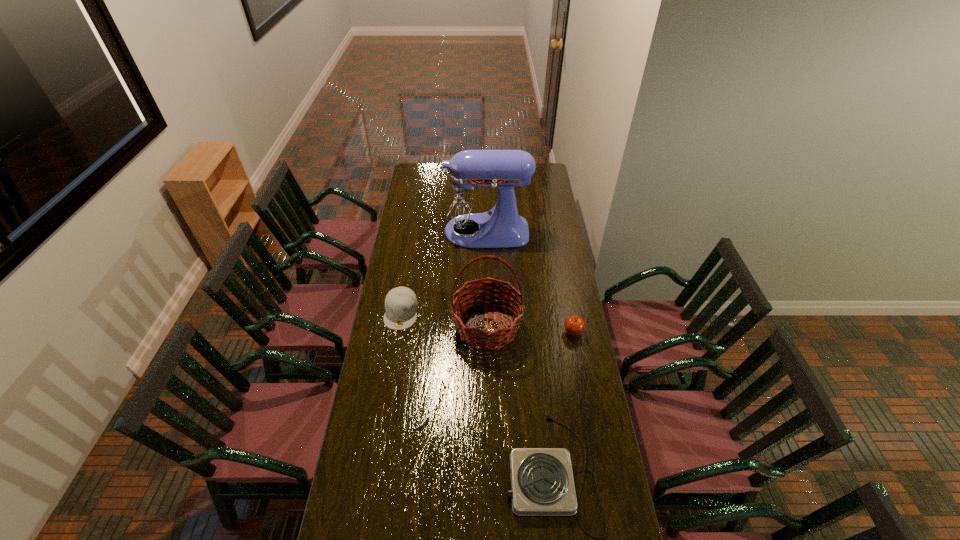
Where is `free space located 0.270m on the front-facing side of the leftmost object`? free space located 0.270m on the front-facing side of the leftmost object is located at coordinates (390, 383).

Where is `blank space located 0.350m on the front of the apple`? The image size is (960, 540). blank space located 0.350m on the front of the apple is located at coordinates (588, 415).

This screenshot has width=960, height=540. Find the location of `free location located with a retractable cable on the side of the nearest object`. free location located with a retractable cable on the side of the nearest object is located at coordinates click(404, 471).

Where is `vacant region located 0.140m with a retractable cable on the side of the nearest object`? vacant region located 0.140m with a retractable cable on the side of the nearest object is located at coordinates (465, 471).

Locate an element on the screen. Image resolution: width=960 pixels, height=540 pixels. vacant space situated with a retractable cable on the side of the nearest object is located at coordinates (473, 471).

This screenshot has height=540, width=960. Find the location of `object present at the left edge`. object present at the left edge is located at coordinates (401, 304).

This screenshot has width=960, height=540. I want to click on apple present at the right edge, so (574, 325).

Identify the location of hotplate at the right edge. This screenshot has width=960, height=540. (542, 484).

You are a GUI agent. You are given a task and a screenshot of the screen. Output one action in this format:
    pyautogui.click(x=<x>, y=<y>)
    Task: Click on the blank space at the left edge of the desktop
    
    Given the screenshot: What is the action you would take?
    pyautogui.click(x=402, y=244)

Locate an element on the screen. This screenshot has height=540, width=960. free spot at the right edge of the desktop is located at coordinates (543, 279).